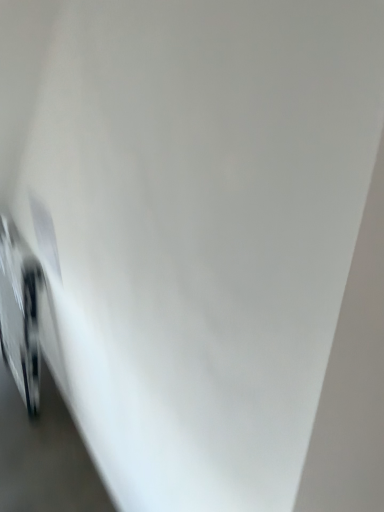
What do you see at coordinates (20, 313) in the screenshot? I see `metallic silver bicycle at left` at bounding box center [20, 313].

Identify the location of metallic silver bicycle at left. Image resolution: width=384 pixels, height=512 pixels. (20, 313).

In order to click on metallic silver bicycle at left in this screenshot , I will do `click(20, 313)`.